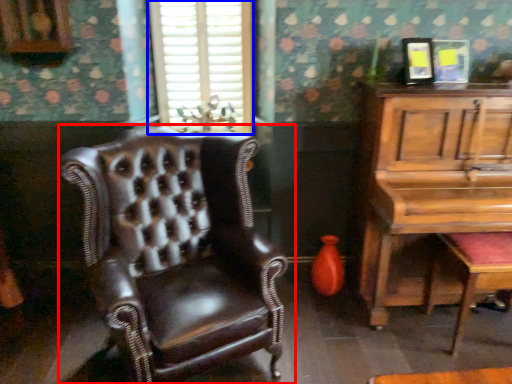
Question: Which point is further to the camera, chair (highlighted by a red box) or window (highlighted by a blue box)?

Choices:
 (A) chair
 (B) window

Answer: (B)